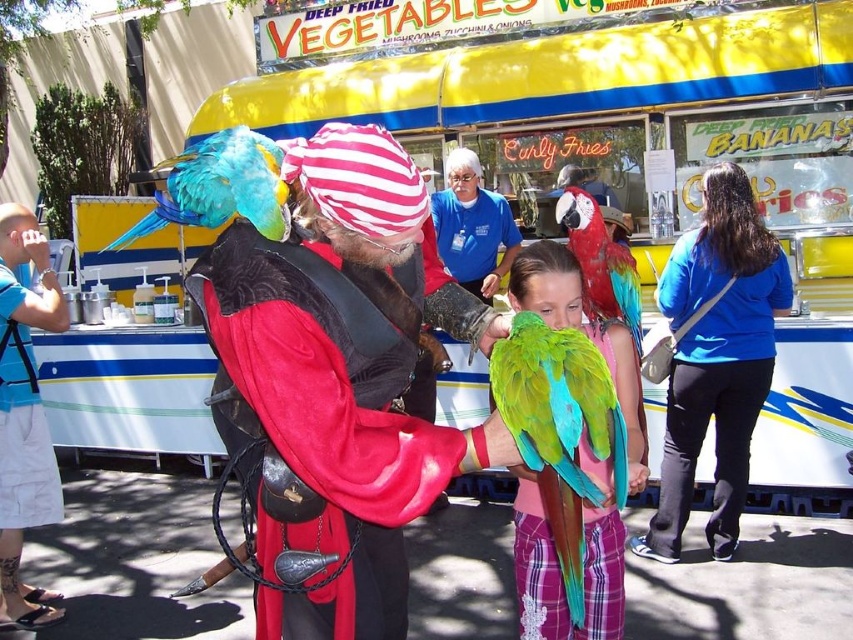
Where is the velvet pirate costume at center located in the image?

The velvet pirate costume at center is located at point (340,381) in the image.